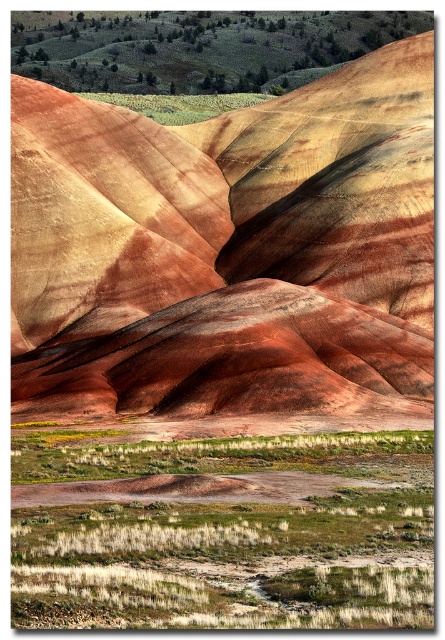
Question: Which of the following is the farthest from the observer?

Choices:
 (A) green grass at lower center
 (B) multicolored sedimentary rock at center

Answer: (B)

Question: Is multicolored sedimentary rock at center to the left of green grass at lower center from the viewer's perspective?

Choices:
 (A) yes
 (B) no

Answer: (A)

Question: Is multicolored sedimentary rock at center to the right of green grass at lower center from the viewer's perspective?

Choices:
 (A) no
 (B) yes

Answer: (A)

Question: Can you confirm if multicolored sedimentary rock at center is positioned to the right of green grass at lower center?

Choices:
 (A) no
 (B) yes

Answer: (A)